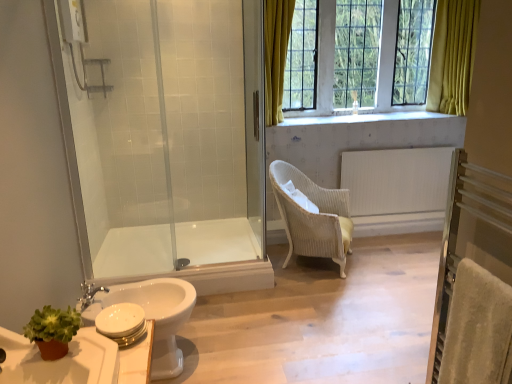
You are a GUI agent. You are given a task and a screenshot of the screen. Output one action in this format:
    pyautogui.click(x=<x>, y=<y>)
    Task: Click on the vacant area on top of beige velvety towel at lower right (from a real-world perspective)
    Image resolution: width=512 pixels, height=384 pixels.
    Given the screenshot: What is the action you would take?
    tap(497, 277)